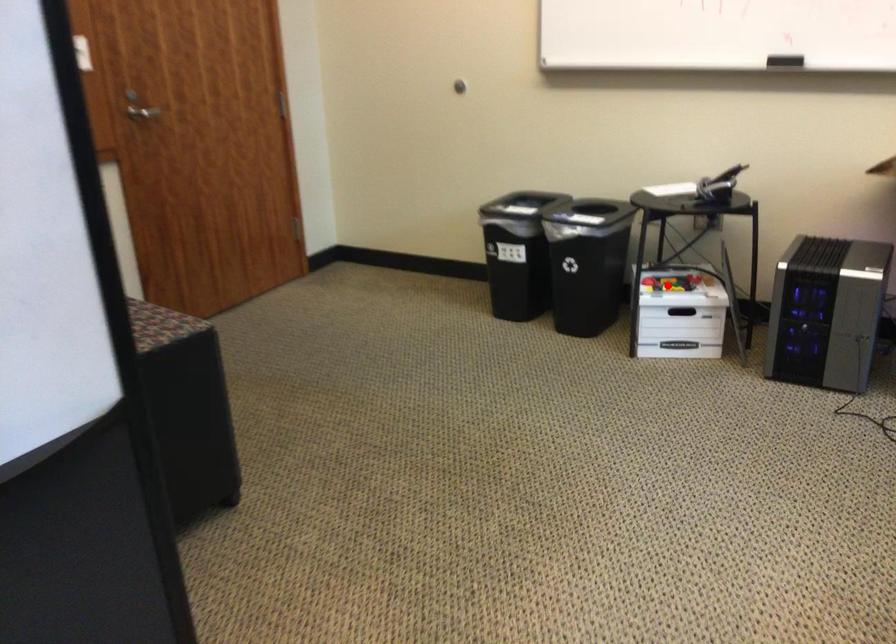
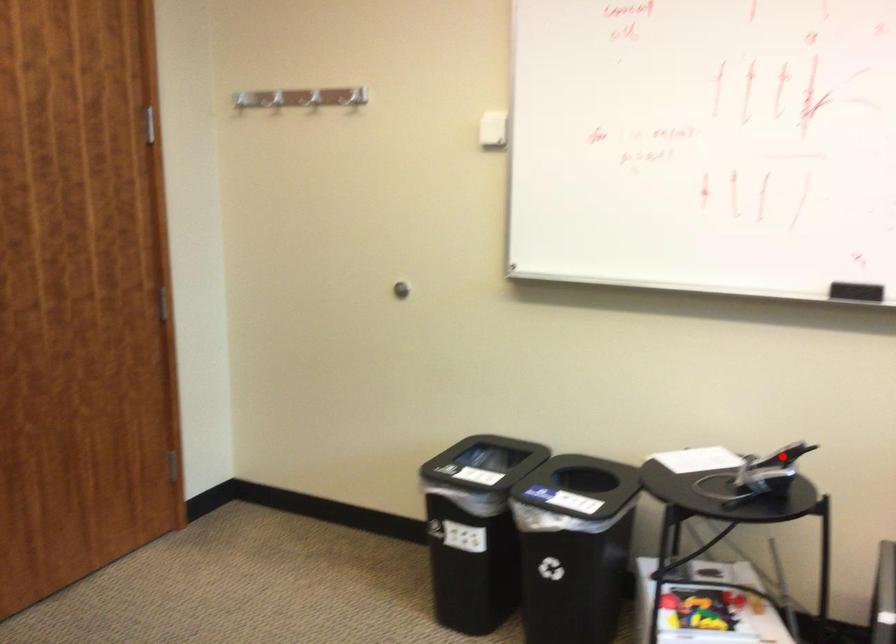
I am providing you with two images of the same scene from different viewpoints. A red point is marked on the first image and another point is marked on the second image. Is the red point in image1 aligned with the point shown in image2?

No